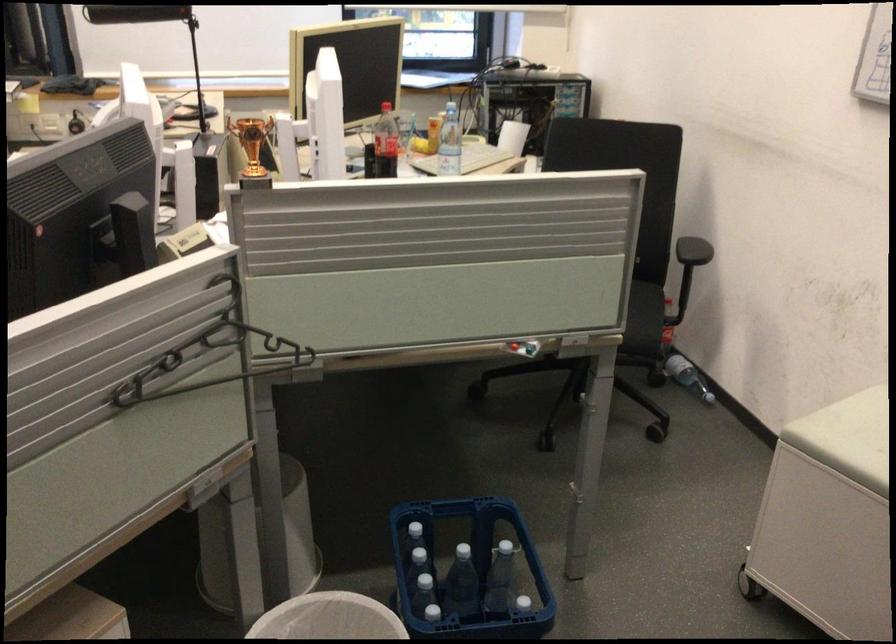
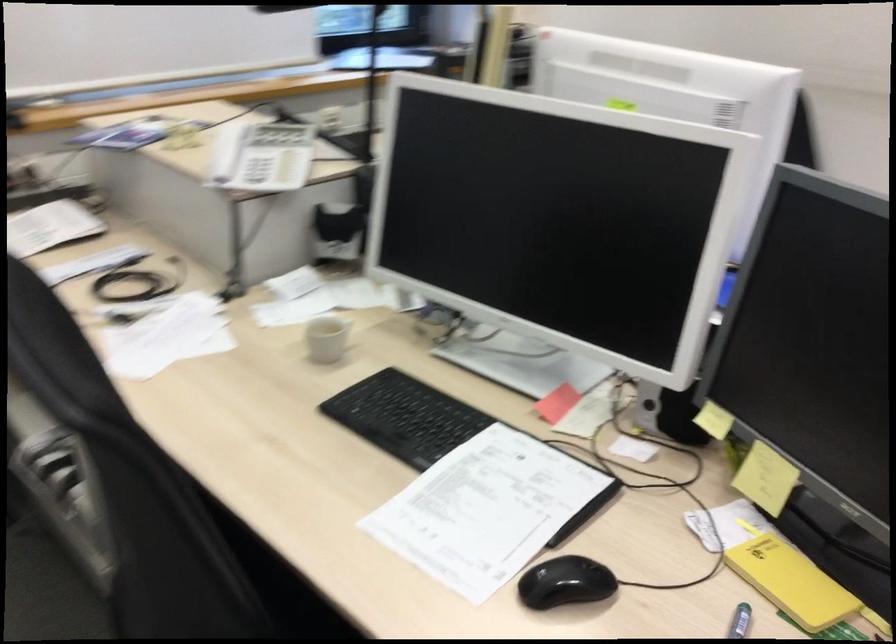
In a continuous first-person perspective shot, in which direction is the camera moving?

The cameraman walked toward left, forward.